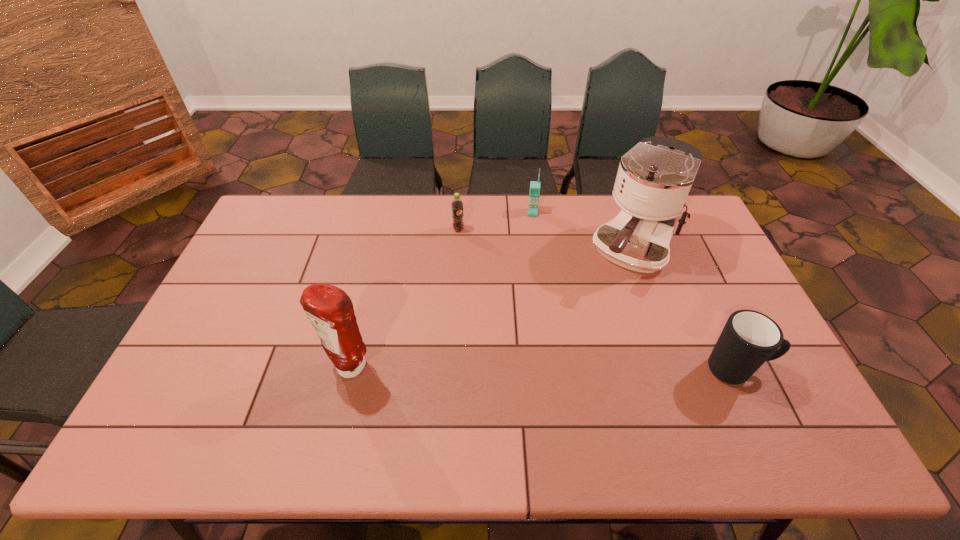
Where is `free point between the coffee maker and the farthest object`? This screenshot has height=540, width=960. free point between the coffee maker and the farthest object is located at coordinates (583, 232).

Select which object is the second closest to the mug. Please provide its 2D coordinates. Your answer should be formatted as a tuple, i.e. [(x, y)], where the tuple contains the x and y coordinates of a point satisfying the conditions above.

[(534, 193)]

This screenshot has height=540, width=960. Find the location of `the second closest object to the coffee maker`. the second closest object to the coffee maker is located at coordinates (749, 338).

Identify the location of free point that satisfies the following two spatial constraints: 1. on the back side of the cellular telephone; 2. on the right side of the second object from left to right. The image size is (960, 540). (459, 212).

You are a GUI agent. You are given a task and a screenshot of the screen. Output one action in this format:
    pyautogui.click(x=<x>, y=<y>)
    Task: Click on the free point that satisfies the following two spatial constraints: 1. on the back side of the fourth shortest object; 2. on the right side of the tallest object
    
    Given the screenshot: What is the action you would take?
    pyautogui.click(x=377, y=252)

At what (x,y) coordinates should I click in order to perform the action: click on vacant point that satisfies the following two spatial constraints: 1. on the front side of the mug; 2. on the side of the farthest object with the handle. Please return your answer as a coordinate pair (x, y). Looking at the image, I should click on (554, 370).

This screenshot has width=960, height=540. What are the coordinates of `blank area in the image that satisfies the following two spatial constraints: 1. on the front side of the mug; 2. on the side of the cellular telephone with the handle` in the screenshot? It's located at (554, 370).

Identify the location of vacant area in the image that satisfies the following two spatial constraints: 1. on the front side of the leftmost object; 2. on the side of the mug with the handle. The height and width of the screenshot is (540, 960). (349, 370).